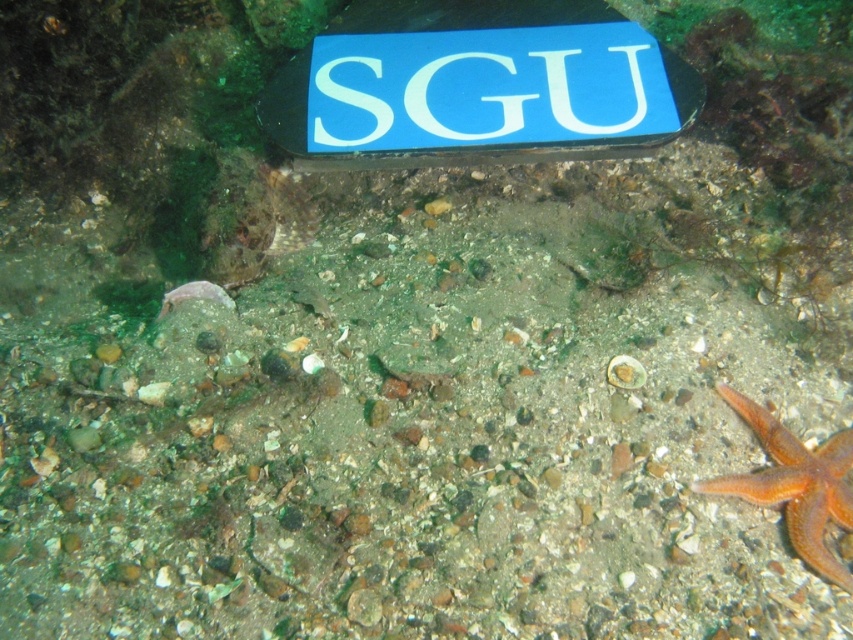
You are a marine biologist examining the underwater scene. You need to determine the relative size of the blue plastic sign at upper center and the orange matte starfish at lower right. Based on the information provided, which object is wider?

The blue plastic sign at upper center might be wider than orange matte starfish at lower right, so the blue plastic sign at upper center is possibly wider.

You are a marine biologist diving underwater and need to collect samples from the orange matte starfish at lower right. Your equipment requires you to stay within 30 inches of the blue plastic sign at upper center to maintain communication with your team. Can you safely collect the sample without losing communication?

The distance between the blue plastic sign at upper center and the orange matte starfish at lower right is 28.32 inches, which is within the 30 inch range required to maintain communication. Therefore, you can safely collect the sample while staying within range.

Looking at this image, you are a diver who needs to retrieve the blue plastic sign at upper center for maintenance. The safety guideline states that you must stay within 5 feet of the seabed to avoid strong currents. Can you safely reach the sign without exceeding this limit?

The blue plastic sign at upper center is 5.34 feet from the camera, which is slightly beyond the 5 feet safety guideline. Therefore, you should not attempt to retrieve it to avoid entering areas with strong currents.